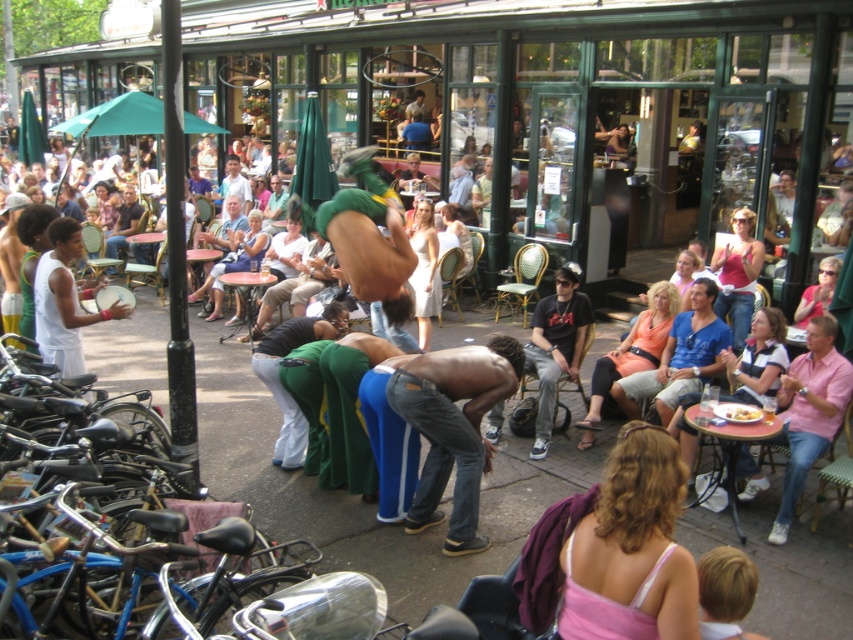
I want to click on denim jeans at center, so click(453, 428).

Consider the image. Is denim jeans at center positioned at the back of yellowish matte plate at lower center?

No, denim jeans at center is in front of yellowish matte plate at lower center.

Is point (444, 452) more distant than point (735, 419)?

No, (444, 452) is closer to viewer.

Where is `denim jeans at center`? This screenshot has width=853, height=640. denim jeans at center is located at coordinates (453, 428).